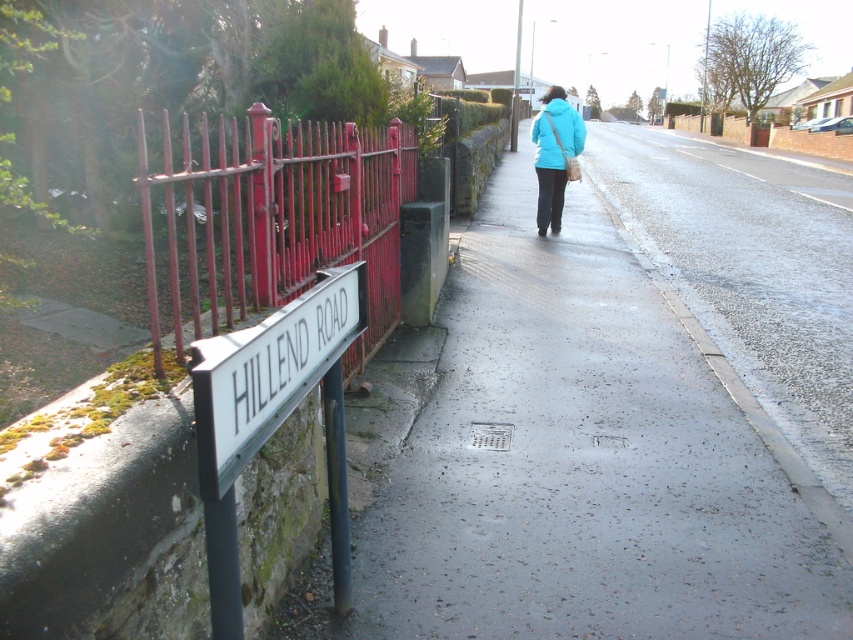
Between teal fabric jacket at center and matte blue jacket at center, which one is positioned lower?

teal fabric jacket at center is lower down.

Locate an element on the screen. This screenshot has width=853, height=640. teal fabric jacket at center is located at coordinates (554, 154).

What are the coordinates of `teal fabric jacket at center` in the screenshot? It's located at (554, 154).

Does red painted metal fence at left have a lesser height compared to white plastic sign at left?

No.

Who is positioned more to the left, red painted metal fence at left or white plastic sign at left?

red painted metal fence at left

The width and height of the screenshot is (853, 640). In order to click on red painted metal fence at left in this screenshot , I will do pyautogui.click(x=270, y=218).

Does red painted metal fence at left lie in front of matte blue jacket at center?

That is True.

Who is more distant from viewer, (254, 253) or (538, 132)?

The point (538, 132) is more distant.

Who is more distant from viewer, (189,157) or (550,125)?

Positioned behind is point (550,125).

Where is `red painted metal fence at left`? red painted metal fence at left is located at coordinates (270, 218).